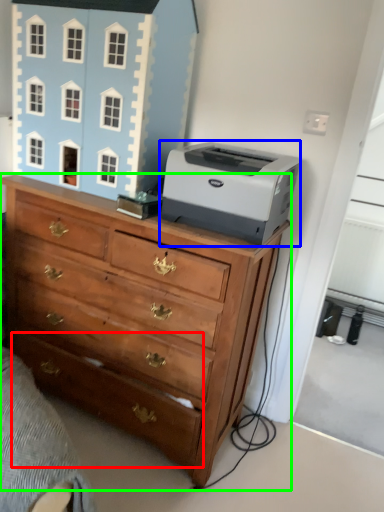
Question: Which object is the farthest from drawer (highlighted by a red box)? Choose among these: printer (highlighted by a blue box) or chest of drawers (highlighted by a green box).

Choices:
 (A) printer
 (B) chest of drawers

Answer: (A)